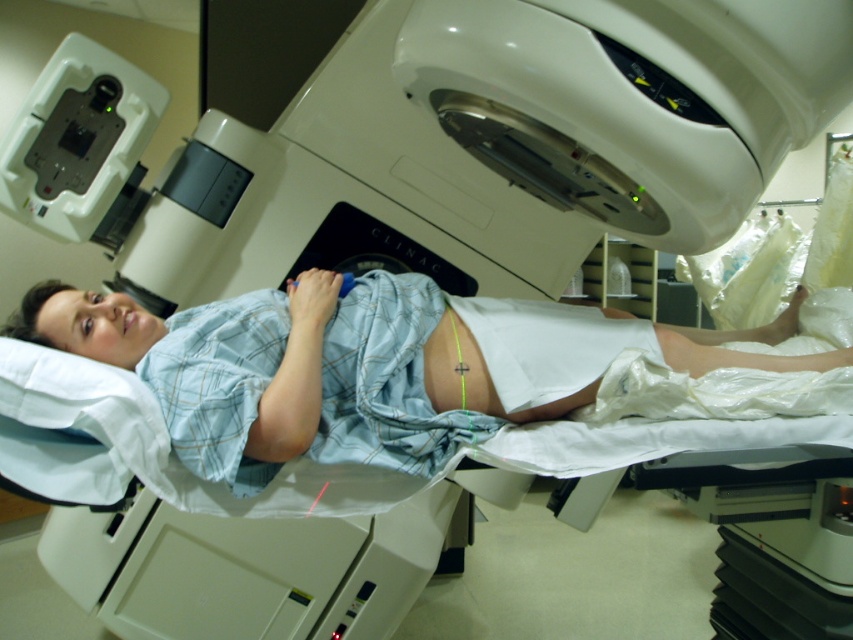
Question: Where is light blue plaid shirt at center located in relation to white plastic device at upper left in the image?

Choices:
 (A) below
 (B) above

Answer: (A)

Question: Based on their relative distances, which object is nearer to the matte skin at center?

Choices:
 (A) light blue plaid shirt at center
 (B) white plastic device at upper left

Answer: (A)

Question: Estimate the real-world distances between objects in this image. Which object is closer to the matte skin at center?

Choices:
 (A) white plastic device at upper left
 (B) light blue plaid shirt at center

Answer: (B)

Question: Is light blue plaid shirt at center bigger than matte skin at center?

Choices:
 (A) yes
 (B) no

Answer: (A)

Question: Can you confirm if light blue plaid shirt at center is positioned to the right of matte skin at center?

Choices:
 (A) yes
 (B) no

Answer: (A)

Question: Which object is closer to the camera taking this photo?

Choices:
 (A) matte skin at center
 (B) white plastic device at upper left
 (C) light blue plaid shirt at center

Answer: (C)